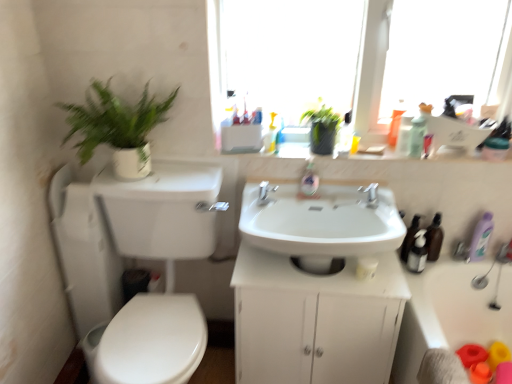
Question: In terms of size, does translucent orange soap dispenser at upper right, which is counted as the second toiletry, starting from the left, appear bigger or smaller than white plastic bathtub at lower right?

Choices:
 (A) small
 (B) big

Answer: (A)

Question: Which is correct: translucent orange soap dispenser at upper right, which is counted as the second toiletry, starting from the left, is inside white plastic bathtub at lower right, or outside of it?

Choices:
 (A) inside
 (B) outside

Answer: (B)

Question: Estimate the real-world distances between objects in this image. Which object is closer to the translucent plastic bottles at upper center?

Choices:
 (A) white glossy sink at center
 (B) translucent plastic soap dispenser at center
 (C) white plastic bathtub at lower right
 (D) green matte plant at upper center
 (E) translucent plastic bottle at upper right, positioned as the third toiletry in left-to-right order

Answer: (D)

Question: Estimate the real-world distances between objects in this image. Which object is closer to the green matte plant at upper center?

Choices:
 (A) transparent glass window at upper center
 (B) white matte cabinet at center
 (C) translucent orange soap dispenser at upper right, which is counted as the second toiletry, starting from the left
 (D) satin black soap dispenser at right, the fourth toiletry from the left
 (E) yellow plastic bottle at upper center, which ranks as the 1th toiletry in left-to-right order

Answer: (E)